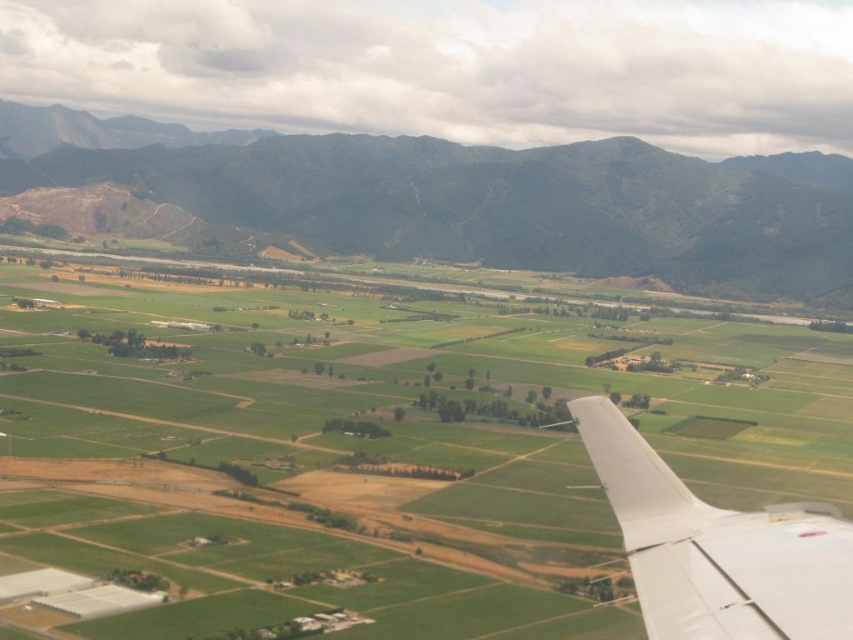
Question: Which point appears closest to the camera in this image?

Choices:
 (A) (651, 465)
 (B) (233, 289)
 (C) (814, 188)

Answer: (A)

Question: In this image, where is green grassland at center located relative to white matte wing at lower right?

Choices:
 (A) below
 (B) above

Answer: (B)

Question: Which object is positioned closest to the green grassy mountain at upper center?

Choices:
 (A) white matte wing at lower right
 (B) green grassland at center

Answer: (B)

Question: Does green grassland at center lie in front of white matte wing at lower right?

Choices:
 (A) no
 (B) yes

Answer: (A)

Question: Which point appears closest to the camera in this image?

Choices:
 (A) (747, 292)
 (B) (657, 509)
 (C) (97, 493)

Answer: (B)

Question: Does green grassland at center lie in front of white matte wing at lower right?

Choices:
 (A) no
 (B) yes

Answer: (A)